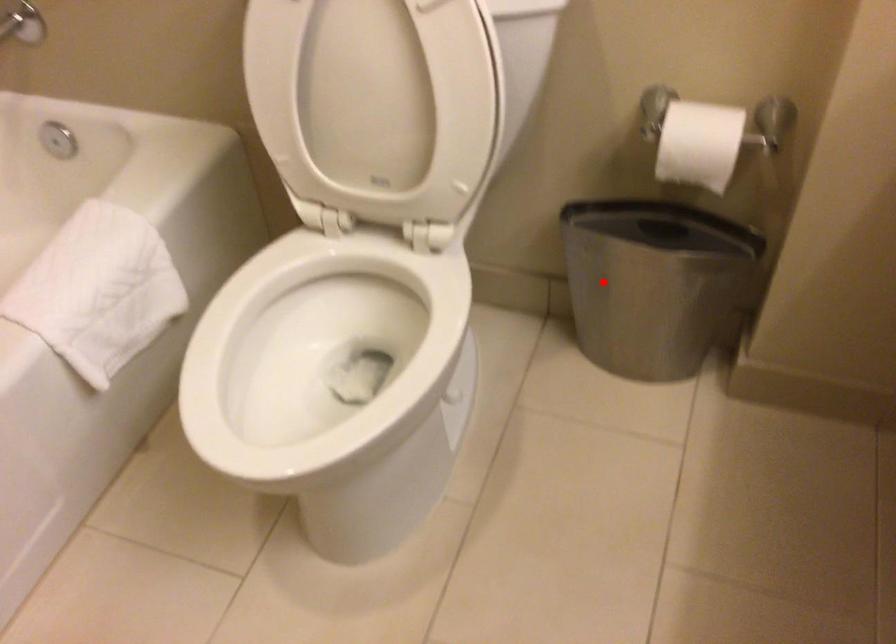
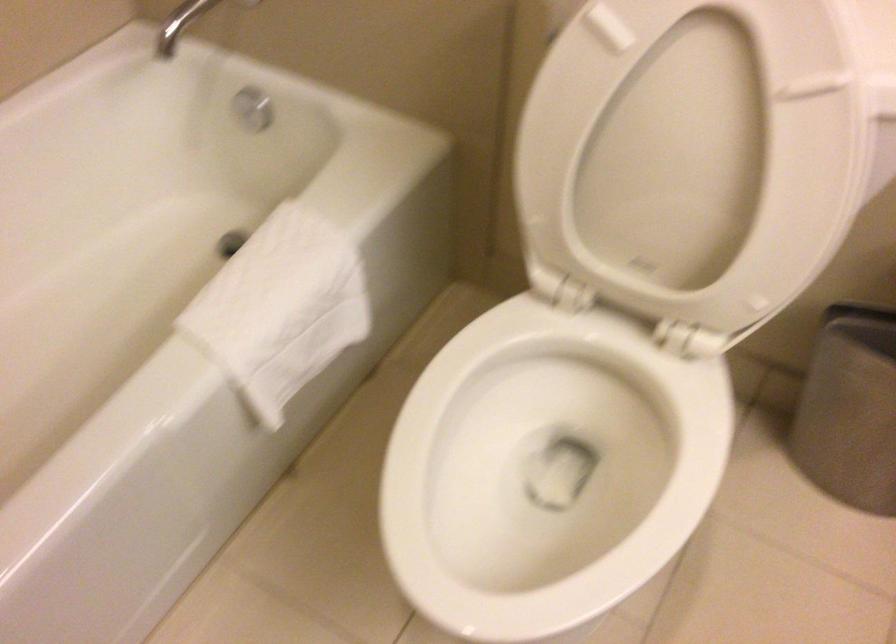
Question: I am providing you with two images of the same scene from different viewpoints. Given a red point in image1, look at the same physical point in image2. Is it:

Choices:
 (A) Closer to the viewpoint
 (B) Farther from the viewpoint

Answer: (A)